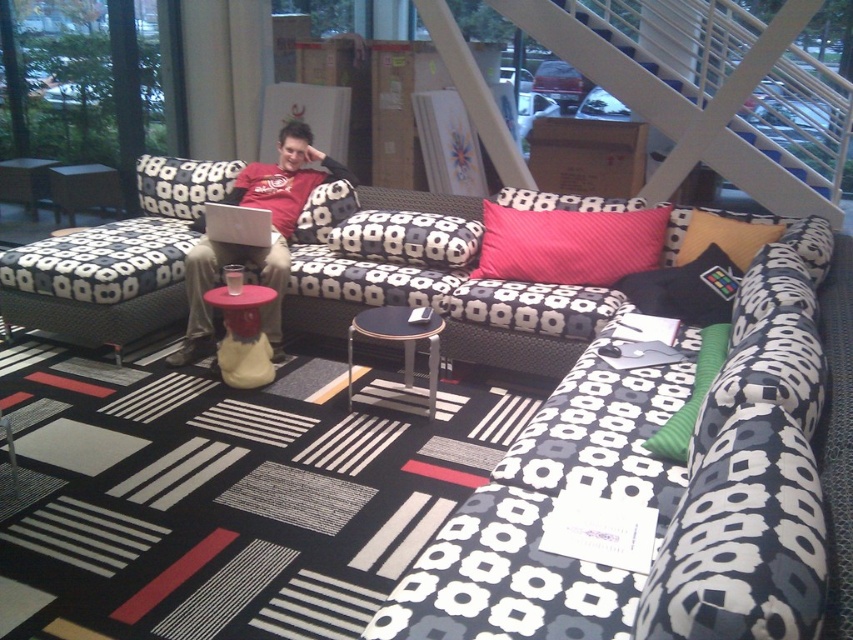
You are sitting on the sofa and want to place a book on the nearest surface. Which object between the green fabric pillow at center and the matte black couch at left is closer to you?

The green fabric pillow at center is closer to you since it is placed at the center of the sofa, while the matte black couch at left is positioned further away on the left side.

You are standing in the lounge and want to place a small plant between the two points, point (503, 276) and point (749, 236). Which point should the plant be closer to in order to be nearer to the viewer?

The plant should be closer to point (503, 276) because it is further to the viewer than point (749, 236).

You are a photographer standing at the camera position. You want to take a closeup photo of the green fabric pillow at center. Is it possible to do so without moving the pillow or camera?

The green fabric pillow at center is 1.89 meters away from camera, so yes, it is possible to take a closeup photo without moving either since the distance is manageable with a zoom lens.